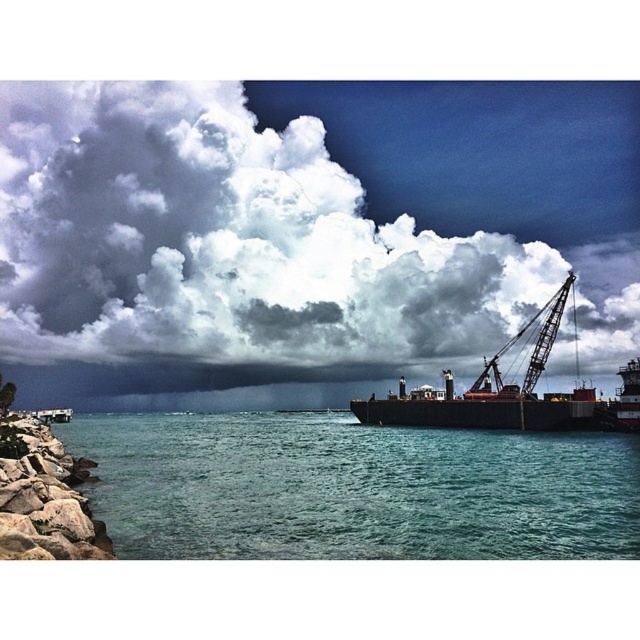
Question: Which of the following is the closest to the observer?

Choices:
 (A) (173, 515)
 (B) (545, 332)
 (C) (476, 380)
 (D) (289, 250)

Answer: (A)

Question: Is white fluffy cloud at upper center below metallic gray crane at right?

Choices:
 (A) yes
 (B) no

Answer: (B)

Question: Is white fluffy cloud at upper center positioned at the back of dark brown metal ship at right?

Choices:
 (A) no
 (B) yes

Answer: (B)

Question: Can you confirm if dark brown metal ship at right is thinner than metallic gray crane at right?

Choices:
 (A) yes
 (B) no

Answer: (B)

Question: Which of the following is the closest to the observer?

Choices:
 (A) metallic gray crane at right
 (B) teal glossy water at lower center

Answer: (B)

Question: Considering the real-world distances, which object is farthest from the dark brown metal ship at right?

Choices:
 (A) metallic gray crane at right
 (B) white fluffy cloud at upper center

Answer: (B)